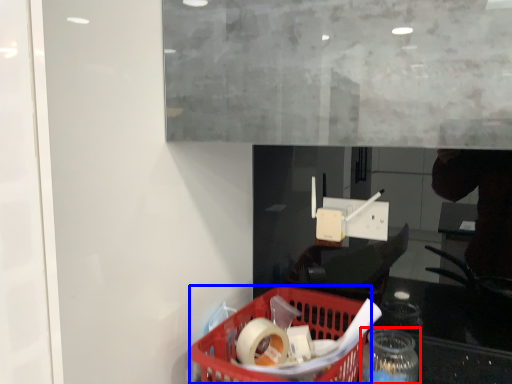
Question: Which object is further to the camera taking this photo, bottle (highlighted by a red box) or basket (highlighted by a blue box)?

Choices:
 (A) bottle
 (B) basket

Answer: (A)